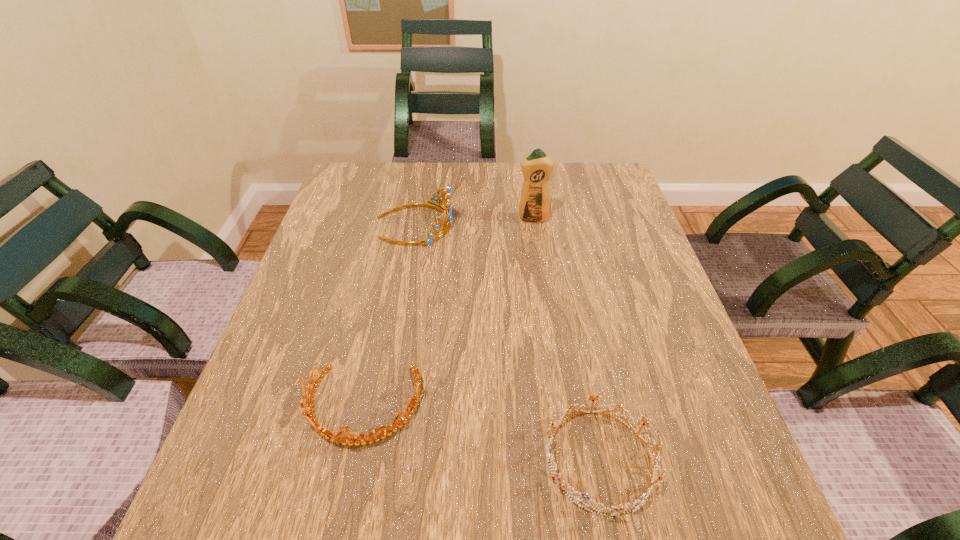
Where is `the tallest object`? The height and width of the screenshot is (540, 960). the tallest object is located at coordinates (534, 207).

Where is `the tallest tiara`? This screenshot has height=540, width=960. the tallest tiara is located at coordinates pos(447,211).

Where is `the farthest tiara`? The image size is (960, 540). the farthest tiara is located at coordinates (447, 211).

Locate an element on the screen. The image size is (960, 540). the second tallest tiara is located at coordinates (338, 438).

Find the location of a particular element. The image size is (960, 540). the rightmost tiara is located at coordinates (620, 510).

Identify the location of the shortest tiara. (620, 510).

Image resolution: width=960 pixels, height=540 pixels. Identify the location of free space located 0.280m on the label of the detergent. (544, 298).

The width and height of the screenshot is (960, 540). Identify the location of vacant space located 0.350m on the front-facing side of the farthest tiara. (580, 224).

At what (x,y) coordinates should I click in order to perform the action: click on free region located 0.050m on the front-facing side of the second shortest object. Please return your answer as a coordinate pair (x, y). This screenshot has width=960, height=540. Looking at the image, I should click on (347, 483).

This screenshot has height=540, width=960. In order to click on object that is at the far edge in this screenshot , I will do `click(447, 211)`.